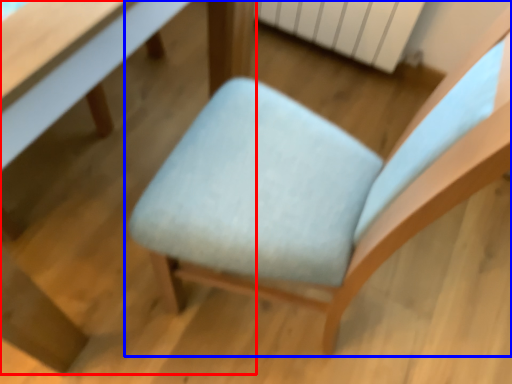
Question: Which object appears farthest to the camera in this image, table (highlighted by a red box) or chair (highlighted by a blue box)?

Choices:
 (A) table
 (B) chair

Answer: (A)